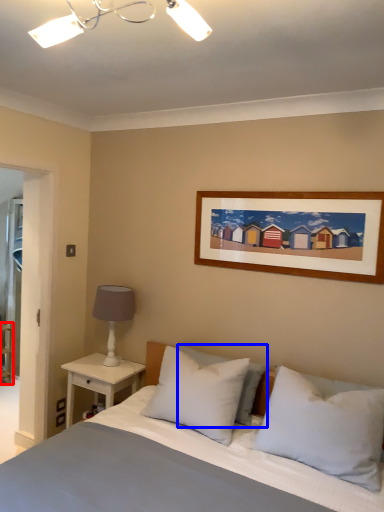
Question: Which of the following is the closest to the observer, shelf (highlighted by a red box) or pillow (highlighted by a blue box)?

Choices:
 (A) shelf
 (B) pillow

Answer: (B)